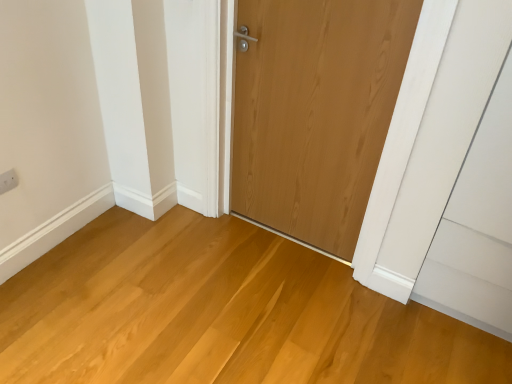
This screenshot has height=384, width=512. I want to click on white plastic electric outlet at upper left, so click(x=8, y=181).

You are a GUI agent. You are given a task and a screenshot of the screen. Output one action in this format:
    pyautogui.click(x=<x>, y=<y>)
    Task: Click on the natural wood floor at center
    This screenshot has height=384, width=512.
    Given the screenshot: What is the action you would take?
    pyautogui.click(x=220, y=313)

In order to face natural wood door at center, should I rotate leftwards or rightwards?

Rotate your view right by about 6.441°.

Locate an element on the screen. The image size is (512, 384). white plastic electric outlet at upper left is located at coordinates (8, 181).

Between natural wood floor at center and white plastic electric outlet at upper left, which one appears on the left side from the viewer's perspective?

From the viewer's perspective, white plastic electric outlet at upper left appears more on the left side.

Looking at this image, is natural wood floor at center with white plastic electric outlet at upper left?

They are not placed beside each other.

In the scene shown: Can you confirm if natural wood floor at center is smaller than white plastic electric outlet at upper left?

Actually, natural wood floor at center might be larger than white plastic electric outlet at upper left.

From a real-world perspective, is natural wood floor at center positioned above or below white plastic electric outlet at upper left?

Clearly, from a real-world perspective, natural wood floor at center is below white plastic electric outlet at upper left.

From the image's perspective, is natural wood floor at center positioned above or below natural wood door at center?

Clearly, from the image's perspective, natural wood floor at center is below natural wood door at center.

Do you think natural wood floor at center is within natural wood door at center, or outside of it?

natural wood floor at center is not enclosed by natural wood door at center.

Is natural wood floor at center smaller than natural wood door at center?

Actually, natural wood floor at center might be larger than natural wood door at center.

Who is more distant, natural wood floor at center or natural wood door at center?

natural wood door at center is further away from the camera.

Can you confirm if white plastic electric outlet at upper left is shorter than natural wood door at center?

Yes.

Is white plastic electric outlet at upper left beside natural wood door at center?

No, white plastic electric outlet at upper left is not next to natural wood door at center.

What are the coordinates of `electric outlet lying below the natural wood door at center (from the image's perspective)` in the screenshot? It's located at (8, 181).

Considering the relative positions of white plastic electric outlet at upper left and natural wood door at center in the image provided, is white plastic electric outlet at upper left to the left or to the right of natural wood door at center?

white plastic electric outlet at upper left is positioned on natural wood door at center's left side.

From a real-world perspective, which is physically above, natural wood door at center or white plastic electric outlet at upper left?

natural wood door at center, from a real-world perspective.

Which of these two, natural wood door at center or white plastic electric outlet at upper left, is bigger?

natural wood door at center is bigger.

In terms of height, does natural wood door at center look taller or shorter compared to white plastic electric outlet at upper left?

Clearly, natural wood door at center is taller compared to white plastic electric outlet at upper left.

At what (x,y) coordinates should I click in order to perform the action: click on door lying in front of the white plastic electric outlet at upper left. Please return your answer as a coordinate pair (x, y). Looking at the image, I should click on (316, 112).

How different are the orientations of white plastic electric outlet at upper left and natural wood floor at center in degrees?

white plastic electric outlet at upper left and natural wood floor at center are facing 91.5 degrees away from each other.

Is white plastic electric outlet at upper left facing away from natural wood floor at center?

white plastic electric outlet at upper left does not have its back to natural wood floor at center.

At what (x,y) coordinates should I click in order to perform the action: click on plain in front of the white plastic electric outlet at upper left. Please return your answer as a coordinate pair (x, y). The image size is (512, 384). Looking at the image, I should click on (220, 313).

From a real-world perspective, is white plastic electric outlet at upper left below natural wood floor at center?

No, from a real-world perspective, white plastic electric outlet at upper left is not beneath natural wood floor at center.

Find the location of `plain below the natural wood door at center (from the image's perspective)`. plain below the natural wood door at center (from the image's perspective) is located at coordinates (220, 313).

Would you say natural wood door at center is inside or outside natural wood floor at center?

natural wood door at center is outside natural wood floor at center.

Does natural wood door at center come in front of natural wood floor at center?

No.

From the image's perspective, is natural wood door at center located above natural wood floor at center?

Indeed, from the image's perspective, natural wood door at center is shown above natural wood floor at center.

The width and height of the screenshot is (512, 384). In order to click on electric outlet located above the natural wood floor at center (from the image's perspective) in this screenshot , I will do `click(8, 181)`.

This screenshot has height=384, width=512. Identify the location of plain that is in front of the natural wood door at center. (220, 313).

When comparing their distances from natural wood door at center, does white plastic electric outlet at upper left or natural wood floor at center seem further?

white plastic electric outlet at upper left is further to natural wood door at center.

From the image, which object appears to be farther from white plastic electric outlet at upper left, natural wood door at center or natural wood floor at center?

The object further to white plastic electric outlet at upper left is natural wood door at center.

Estimate the real-world distances between objects in this image. Which object is further from white plastic electric outlet at upper left, natural wood floor at center or natural wood door at center?

natural wood door at center is further to white plastic electric outlet at upper left.

Based on their spatial positions, is white plastic electric outlet at upper left or natural wood door at center closer to natural wood floor at center?

natural wood door at center is positioned closer to the anchor natural wood floor at center.

Estimate the real-world distances between objects in this image. Which object is closer to natural wood door at center, natural wood floor at center or white plastic electric outlet at upper left?

natural wood floor at center is positioned closer to the anchor natural wood door at center.

Consider the image. Estimate the real-world distances between objects in this image. Which object is further from natural wood floor at center, natural wood door at center or white plastic electric outlet at upper left?

The object further to natural wood floor at center is white plastic electric outlet at upper left.

I want to click on plain between white plastic electric outlet at upper left and natural wood door at center in the horizontal direction, so click(x=220, y=313).